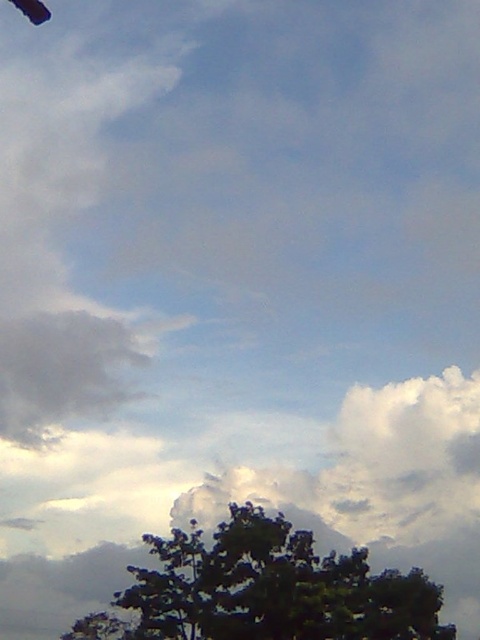
Question: Does green leafy tree at lower center come in front of dark blue fabric parachute at upper left?

Choices:
 (A) no
 (B) yes

Answer: (A)

Question: From the image, what is the correct spatial relationship of green leafy tree at lower center in relation to dark blue fabric parachute at upper left?

Choices:
 (A) right
 (B) left

Answer: (A)

Question: Is green leafy tree at lower center thinner than dark blue fabric parachute at upper left?

Choices:
 (A) no
 (B) yes

Answer: (A)

Question: Which of the following is the closest to the observer?

Choices:
 (A) green leafy tree at lower center
 (B) dark blue fabric parachute at upper left

Answer: (B)

Question: Which object is closer to the camera taking this photo?

Choices:
 (A) dark blue fabric parachute at upper left
 (B) green leafy tree at lower center

Answer: (A)

Question: Which point is closer to the camera?

Choices:
 (A) (29, 10)
 (B) (385, 604)

Answer: (A)